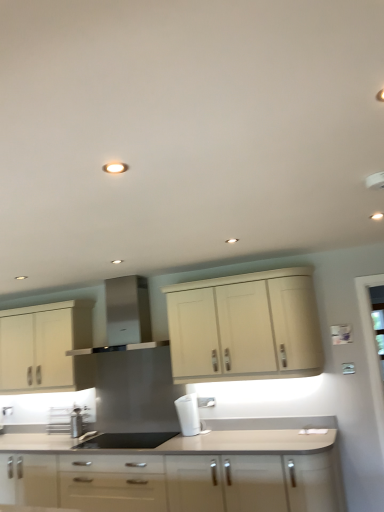
This screenshot has width=384, height=512. Find the location of `vacant area on top of metallic stainless steel spice rack at lower left (from a real-world perspective)`. vacant area on top of metallic stainless steel spice rack at lower left (from a real-world perspective) is located at coordinates (63, 400).